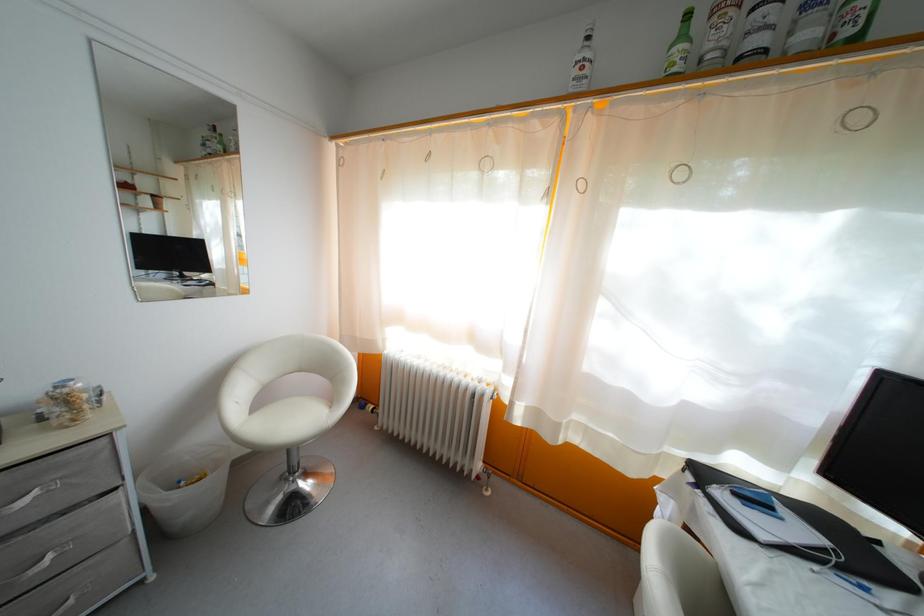
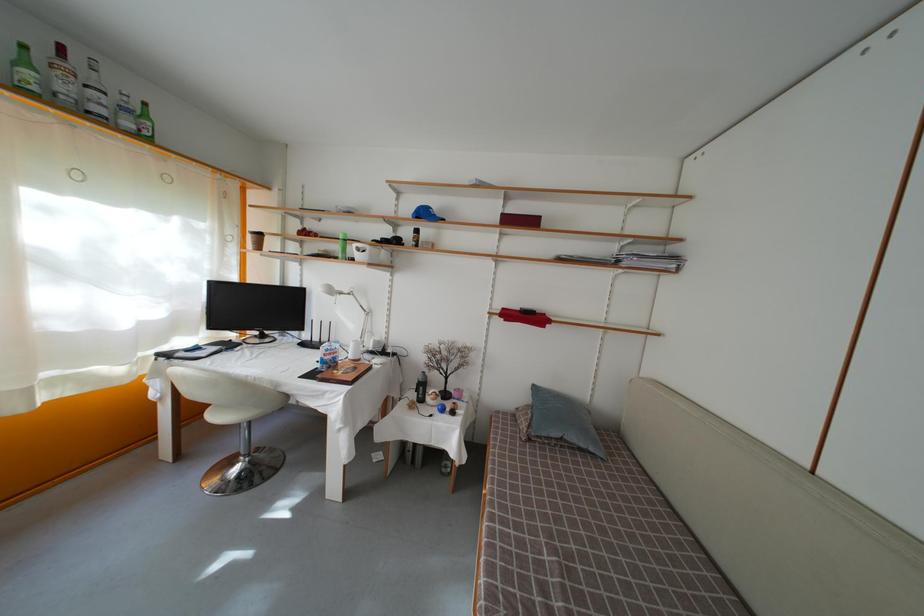
Find the pixel in the second image that matches point (721, 46) in the first image.

(69, 95)